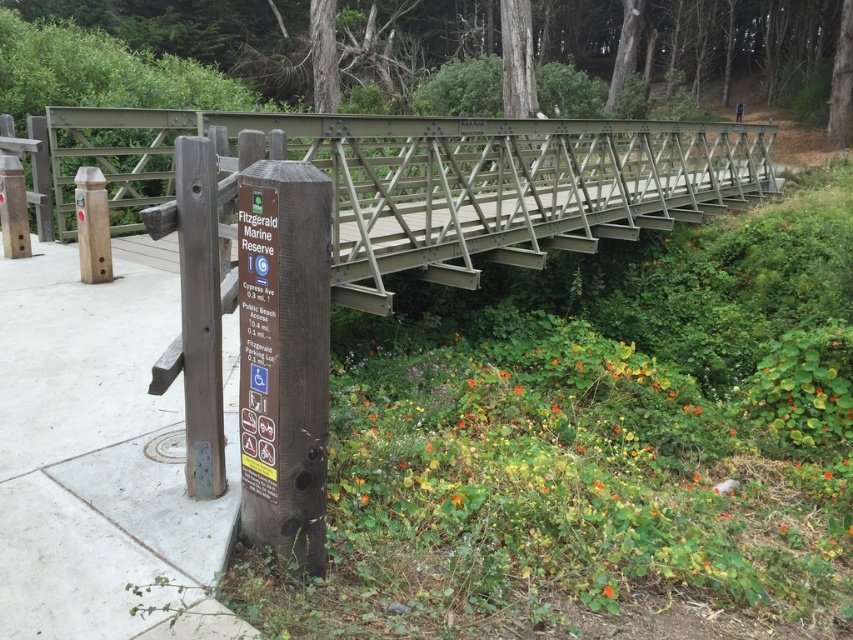
Question: From the image, what is the correct spatial relationship of white concrete sidewalk at lower left in relation to brown wooden signpost at lower left?

Choices:
 (A) above
 (B) below

Answer: (B)

Question: Based on their relative distances, which object is nearer to the brown wooden signpost at lower left?

Choices:
 (A) wooden signpost at lower left
 (B) metallic gray bridge at upper center

Answer: (A)

Question: Is brown wooden signpost at lower left above brown wood post at left?

Choices:
 (A) no
 (B) yes

Answer: (A)

Question: Which point is farther to the camera?

Choices:
 (A) (268, 237)
 (B) (566, 212)
 (C) (91, 202)

Answer: (B)

Question: Which object is farther from the camera taking this photo?

Choices:
 (A) brown wooden signpost at lower left
 (B) brown wood post at left
 (C) wooden signpost at lower left
 (D) metallic gray bridge at upper center

Answer: (B)

Question: Is white concrete sidewalk at lower left thinner than brown wood post at left?

Choices:
 (A) yes
 (B) no

Answer: (B)